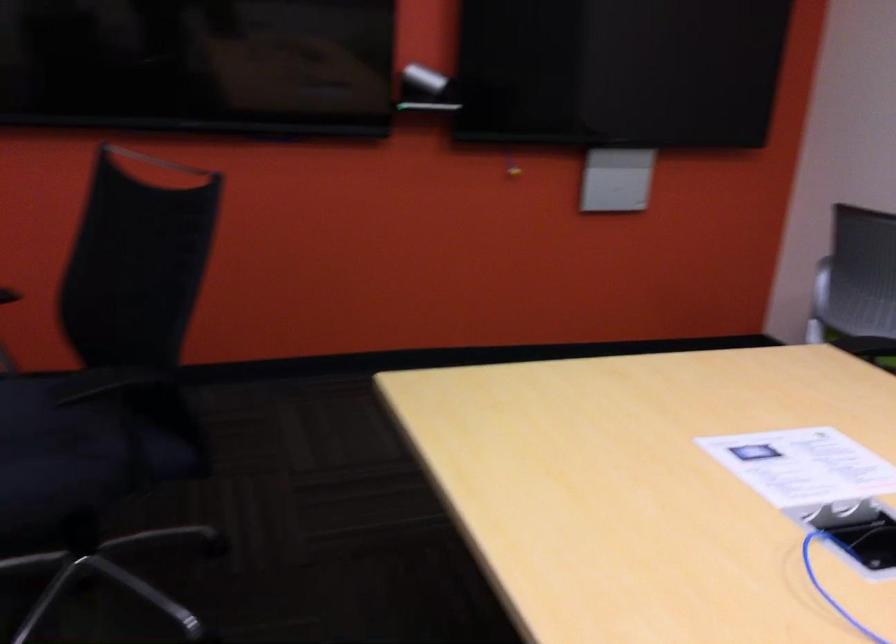
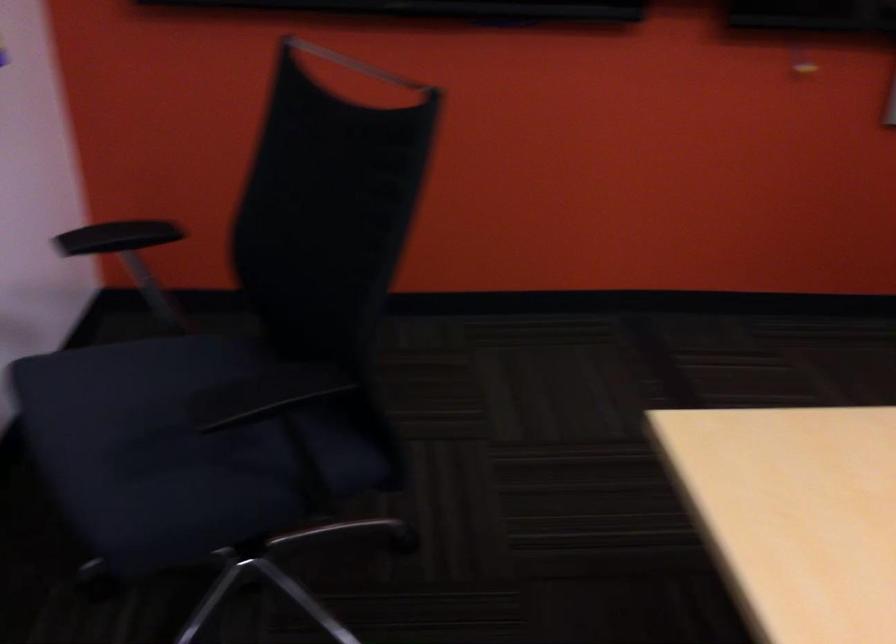
Question: Which direction would the cameraman need to move to produce the second image? Reply with the corresponding letter.

Choices:
 (A) Left
 (B) Right
 (C) Forward
 (D) Backward

Answer: (C)